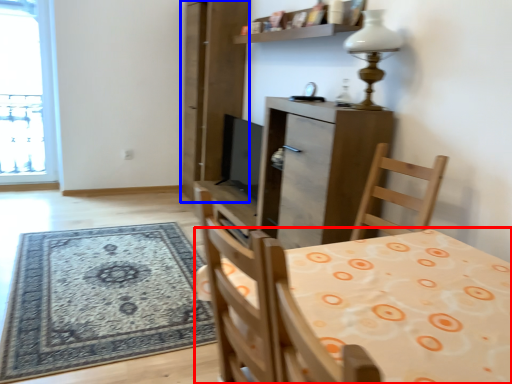
Question: Which object appears farthest to the camera in this image, table (highlighted by a red box) or screen door (highlighted by a blue box)?

Choices:
 (A) table
 (B) screen door

Answer: (B)